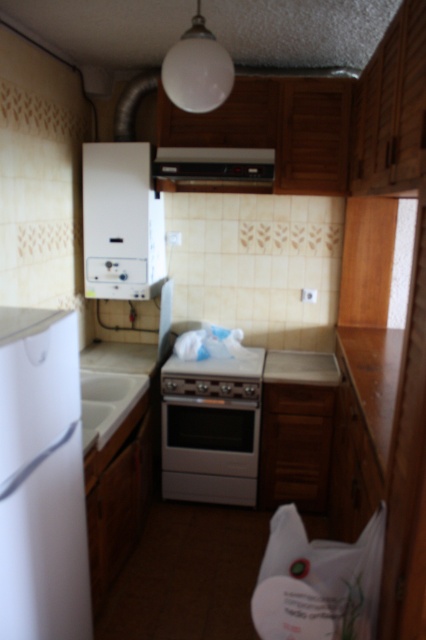
Question: Does white glossy oven at center come behind white glossy sink at lower left?

Choices:
 (A) yes
 (B) no

Answer: (A)

Question: Among these points, which one is farthest from the camera?

Choices:
 (A) (x=195, y=157)
 (B) (x=109, y=204)

Answer: (B)

Question: Does white matte refrigerator at left have a lesser width compared to white glossy oven at center?

Choices:
 (A) no
 (B) yes

Answer: (B)

Question: Which of the following is the closest to the observer?

Choices:
 (A) (181, 387)
 (B) (141, 234)
 (C) (210, 182)

Answer: (A)

Question: Can you confirm if white matte refrigerator at left is positioned to the right of white glossy sink at lower left?

Choices:
 (A) no
 (B) yes

Answer: (A)

Question: Considering the real-world distances, which object is farthest from the black matte exhaust hood at upper center?

Choices:
 (A) white matte refrigerator at left
 (B) wooden at right
 (C) white glossy sink at lower left
 (D) white glossy oven at center

Answer: (A)